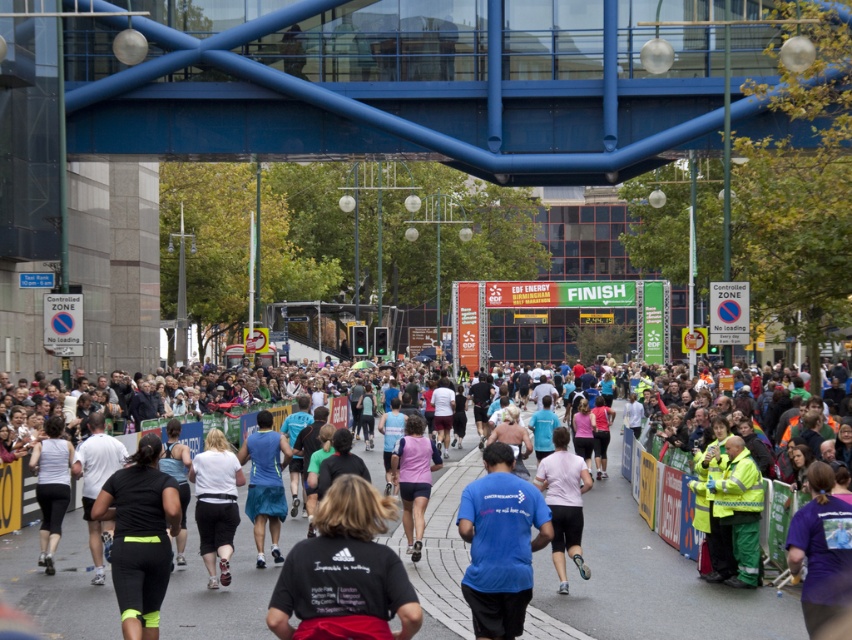
Question: Which point appears closest to the camera in this image?

Choices:
 (A) (780, 602)
 (B) (378, 56)

Answer: (A)

Question: Which point is farther to the camera?

Choices:
 (A) (563, 16)
 (B) (626, 484)

Answer: (A)

Question: Does blue metallic bridge at upper center have a smaller size compared to white cotton shirt at center?

Choices:
 (A) no
 (B) yes

Answer: (A)

Question: Among these points, which one is farthest from the camera?

Choices:
 (A) (602, 61)
 (B) (72, 541)

Answer: (A)

Question: Does blue metallic bridge at upper center have a greater width compared to white cotton shirt at center?

Choices:
 (A) no
 (B) yes

Answer: (B)

Question: Does blue metallic bridge at upper center have a smaller size compared to white cotton shirt at center?

Choices:
 (A) yes
 (B) no

Answer: (B)